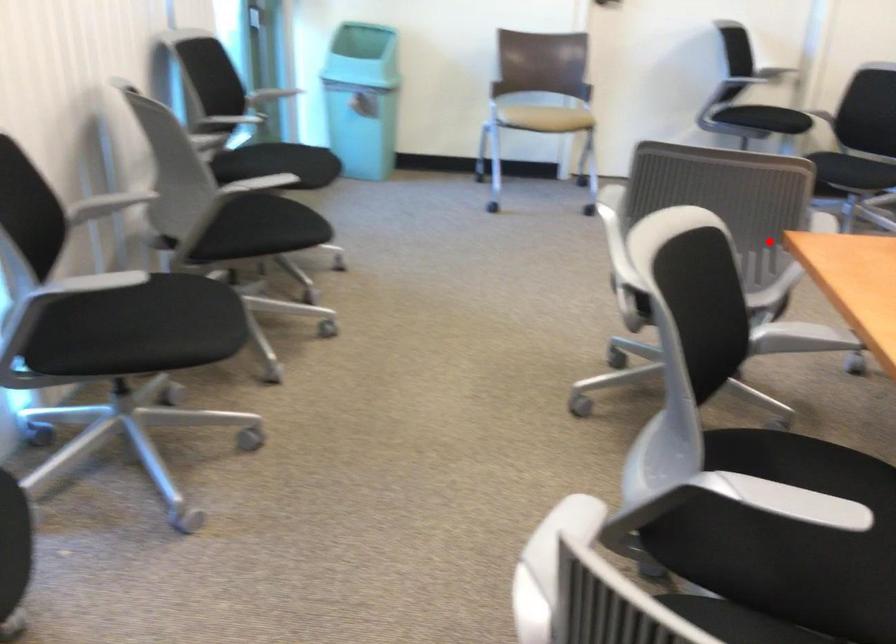
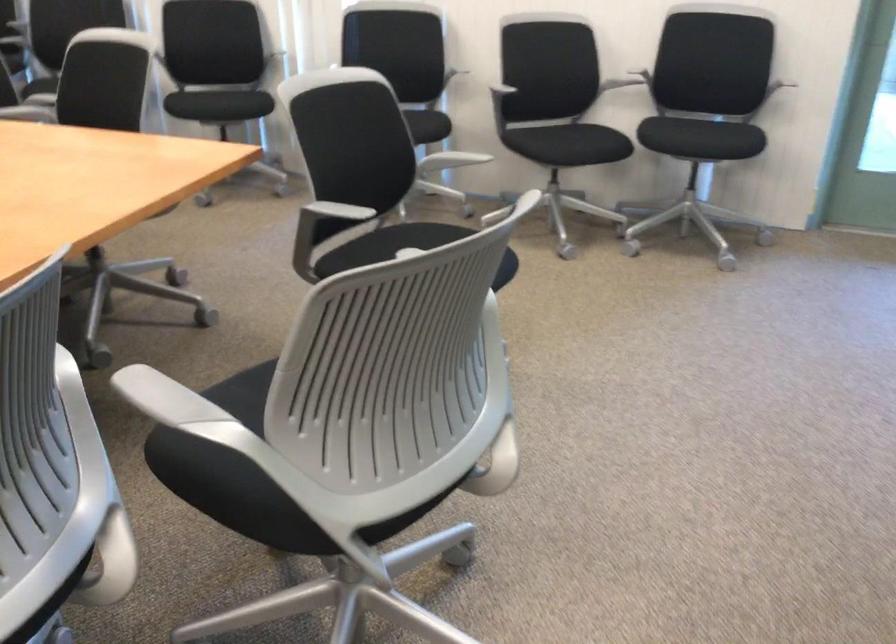
Find the pixel in the second image that matches the highlighted location in the first image.

(332, 212)